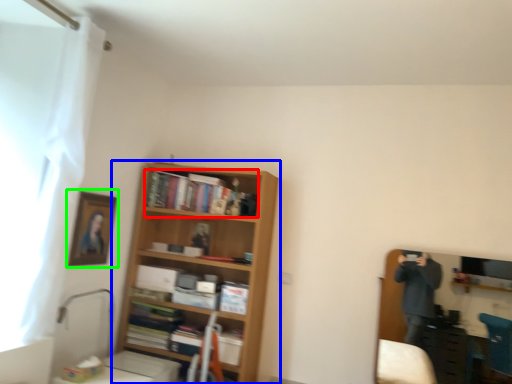
Question: Which is nearer to the book (highlighted by a red box)? shelf (highlighted by a blue box) or picture frame (highlighted by a green box).

Choices:
 (A) shelf
 (B) picture frame

Answer: (A)